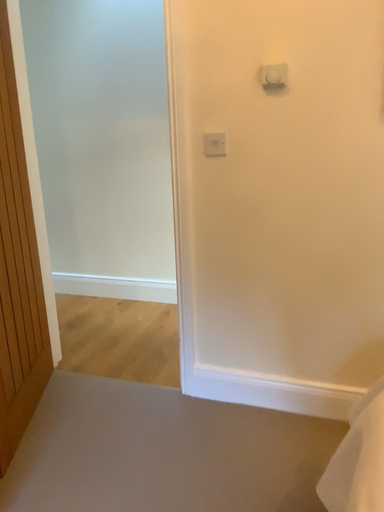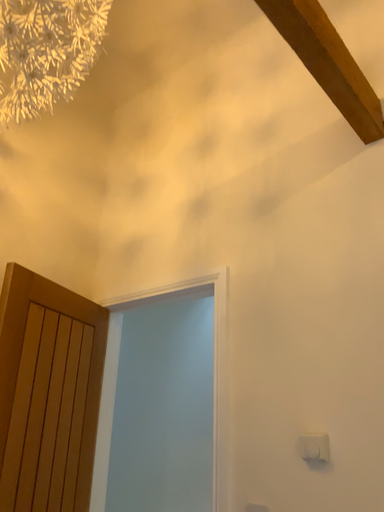
Question: Which way did the camera rotate in the video?

Choices:
 (A) rotated right
 (B) rotated left

Answer: (B)